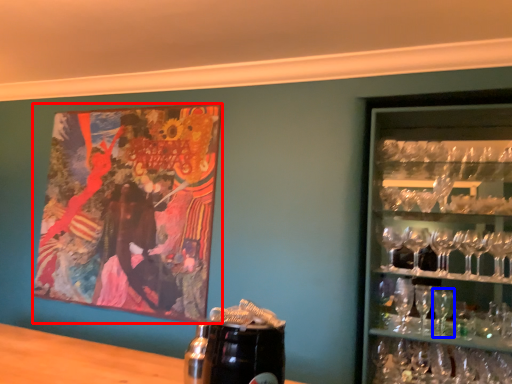
Question: Which object appears farthest to the camera in this image, picture frame (highlighted by a red box) or martini glass (highlighted by a blue box)?

Choices:
 (A) picture frame
 (B) martini glass

Answer: (A)